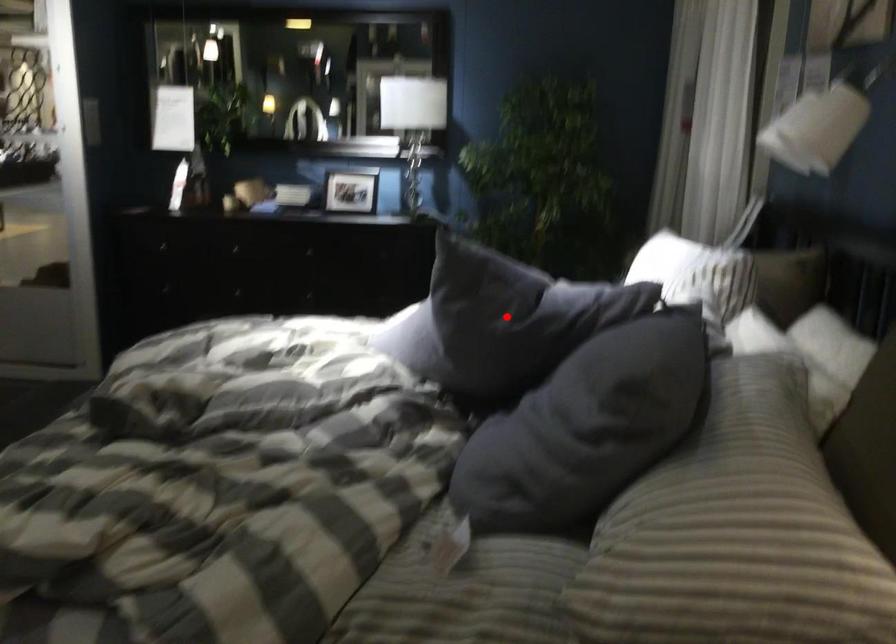
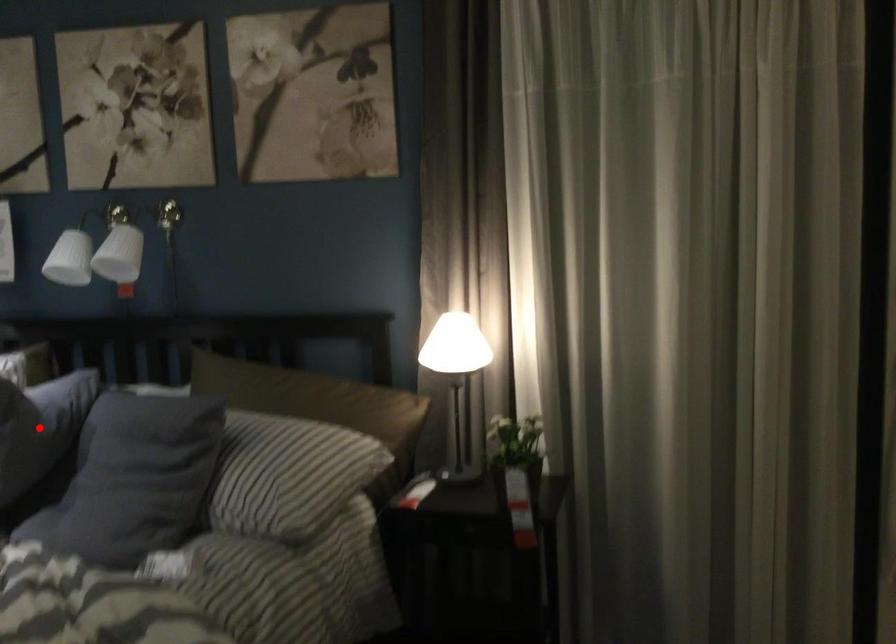
I am providing you with two images of the same scene from different viewpoints. A red point is marked on the first image and another point is marked on the second image. Is the marked point in image1 the same physical position as the marked point in image2?

Yes